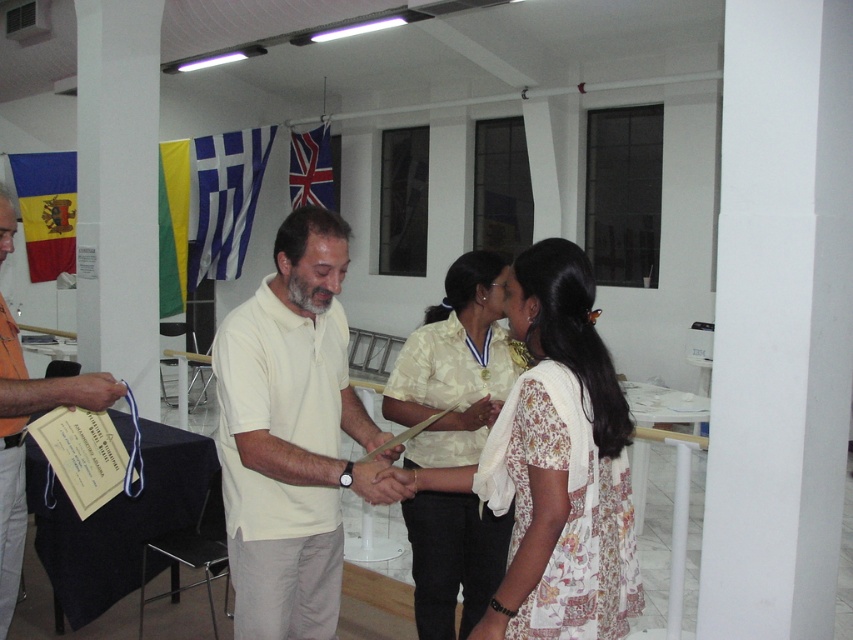
Does point (514, 582) come closer to viewer compared to point (318, 131)?

Yes, it is in front of point (318, 131).

Who is positioned more to the left, white floral dress at center or union jack fabric flag at upper center?

union jack fabric flag at upper center

At what (x,y) coordinates should I click in order to perform the action: click on white floral dress at center. Please return your answer as a coordinate pair (x, y). This screenshot has height=640, width=853. Looking at the image, I should click on (560, 465).

Identify the location of white floral dress at center. (560, 465).

Is yellow-green fabric flag at upper left to the left of union jack fabric flag at upper center from the viewer's perspective?

Yes, yellow-green fabric flag at upper left is to the left of union jack fabric flag at upper center.

Does yellow-green fabric flag at upper left lie in front of union jack fabric flag at upper center?

Yes, yellow-green fabric flag at upper left is in front of union jack fabric flag at upper center.

Which is in front, point (184, 145) or point (300, 196)?

Point (184, 145) is more forward.

Locate an element on the screen. yellow-green fabric flag at upper left is located at coordinates (172, 225).

Does yellow textured blouse at center have a greater width compared to orange fabric shirt at left?

Incorrect, yellow textured blouse at center's width does not surpass orange fabric shirt at left's.

I want to click on yellow textured blouse at center, so click(454, 365).

The width and height of the screenshot is (853, 640). I want to click on yellow textured blouse at center, so click(454, 365).